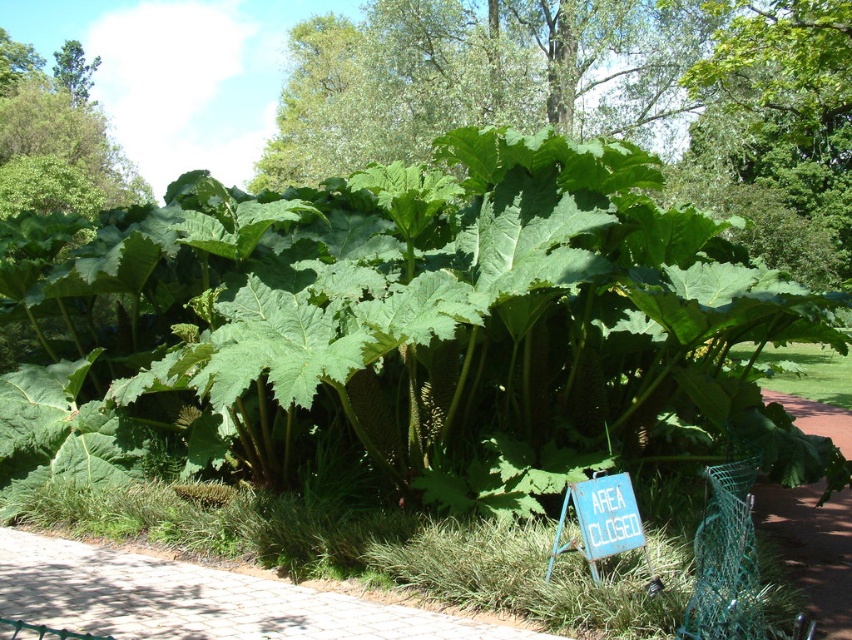
Question: Which object is farther from the camera taking this photo?

Choices:
 (A) green leafy plant at center
 (B) cobblestone path at lower left

Answer: (A)

Question: Is green leafy plant at center bigger than cobblestone path at lower left?

Choices:
 (A) no
 (B) yes

Answer: (B)

Question: Which point is closer to the camera?

Choices:
 (A) cobblestone path at lower left
 (B) green leafy plant at center

Answer: (A)

Question: Is green leafy plant at center positioned behind cobblestone path at lower left?

Choices:
 (A) no
 (B) yes

Answer: (B)

Question: Where is green leafy plant at center located in relation to cobblestone path at lower left in the image?

Choices:
 (A) above
 (B) below

Answer: (A)

Question: Which of the following is the farthest from the observer?

Choices:
 (A) cobblestone path at lower left
 (B) green leafy plant at center

Answer: (B)